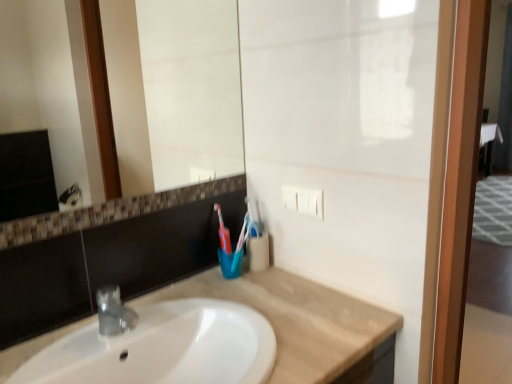
Question: From a real-world perspective, is white glossy mirror at upper center positioned above or below beige marble countertop at center?

Choices:
 (A) above
 (B) below

Answer: (A)

Question: In terms of size, does white glossy mirror at upper center appear bigger or smaller than beige marble countertop at center?

Choices:
 (A) big
 (B) small

Answer: (B)

Question: Estimate the real-world distances between objects in this image. Which object is closer to the white glossy mirror at upper center?

Choices:
 (A) blue plastic toothbrush at center
 (B) beige marble countertop at center
 (C) wooden screen door at right

Answer: (B)

Question: Based on their relative distances, which object is farther from the white glossy mirror at upper center?

Choices:
 (A) beige marble countertop at center
 (B) wooden screen door at right
 (C) blue plastic toothbrush at center

Answer: (B)